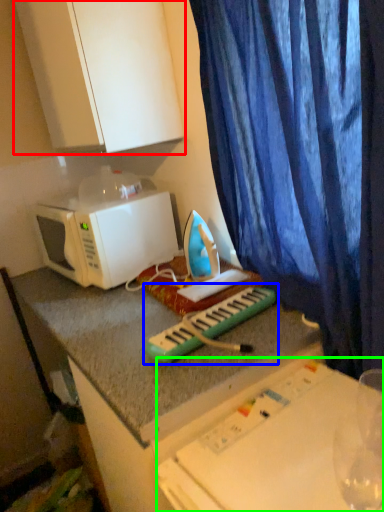
Question: Which object is positioned closest to cabinetry (highlighted by a red box)? Select from musical keyboard (highlighted by a blue box) and table (highlighted by a green box).

Choices:
 (A) musical keyboard
 (B) table

Answer: (A)